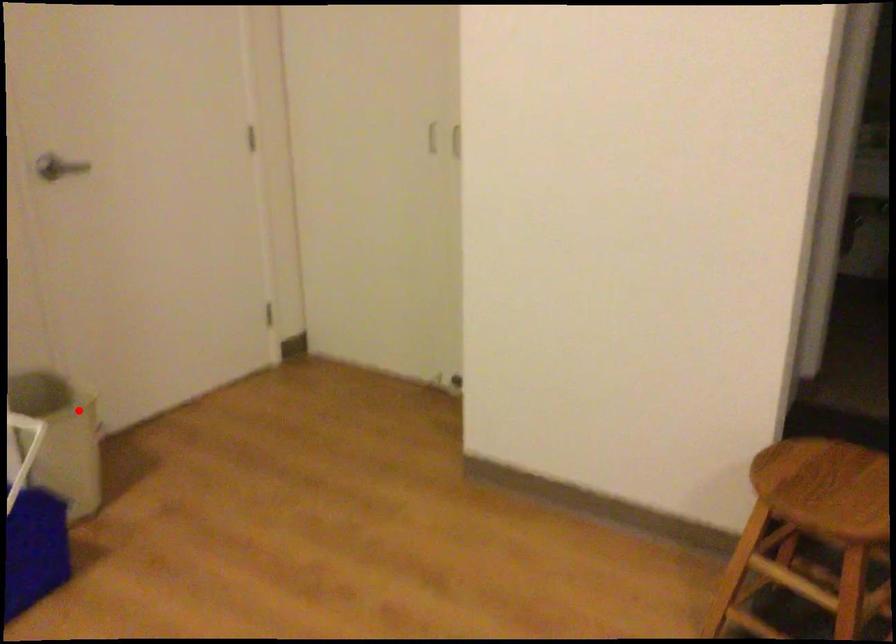
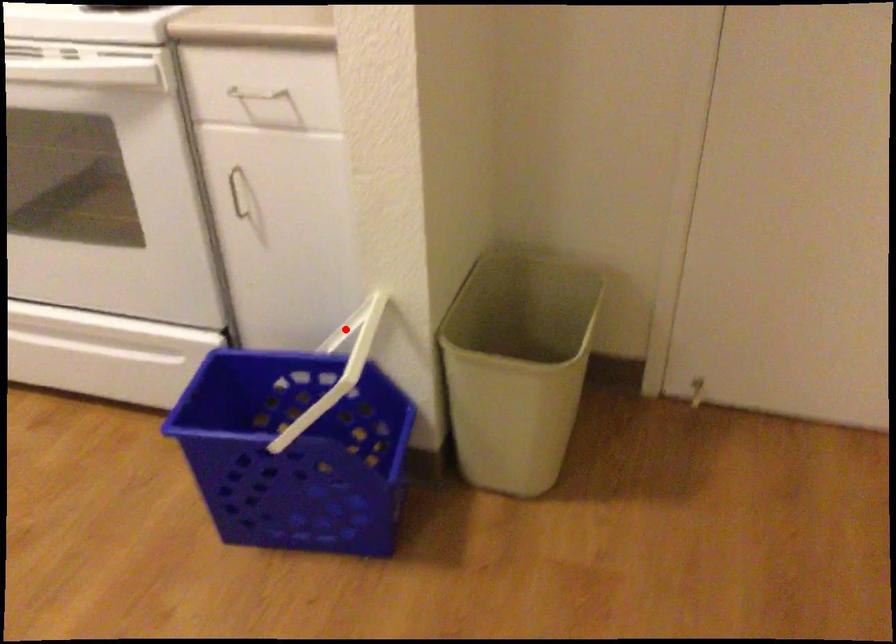
I am providing you with two images of the same scene from different viewpoints. A red point is marked on the first image and another point is marked on the second image. Does the point marked in image1 correspond to the same location as the one in image2?

No